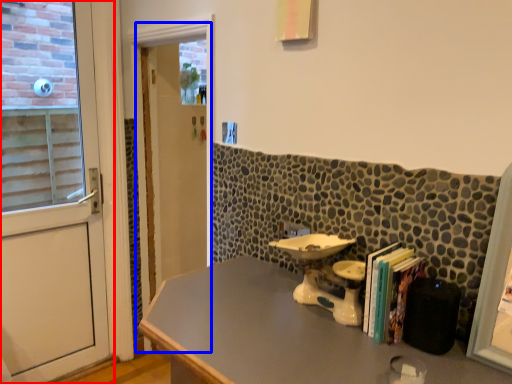
Question: Which of the following is the farthest to the observer, door (highlighted by a red box) or screen door (highlighted by a blue box)?

Choices:
 (A) door
 (B) screen door

Answer: (B)